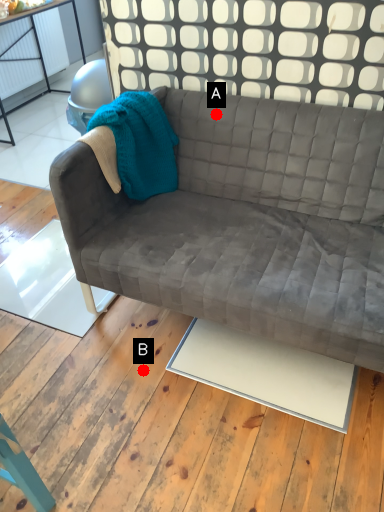
Question: Two points are circled on the image, labeled by A and B beside each circle. Which point is closer to the camera?

Choices:
 (A) A is closer
 (B) B is closer

Answer: (B)